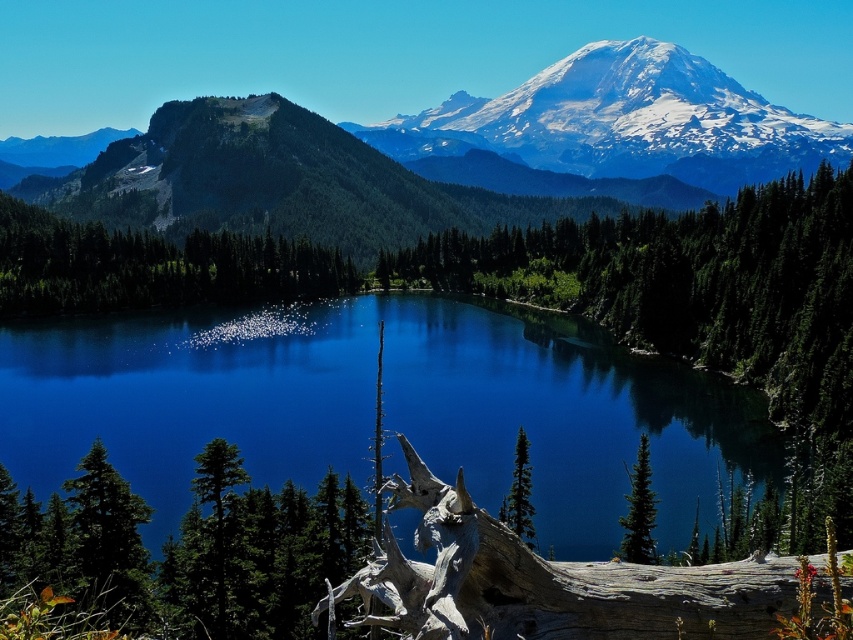
Question: Can you confirm if green matte tree at center-right is positioned to the right of green matte tree at center?

Choices:
 (A) yes
 (B) no

Answer: (A)

Question: Which object is closer to the camera taking this photo?

Choices:
 (A) green forested mountain at upper left
 (B) green matte tree at center
 (C) deep blue water at center

Answer: (B)

Question: Is gray textured log at lower center bigger than green matte tree at center-right?

Choices:
 (A) yes
 (B) no

Answer: (A)

Question: Considering the real-world distances, which object is closest to the green matte tree at center-right?

Choices:
 (A) gray textured log at lower center
 (B) deep blue water at center

Answer: (A)

Question: Based on their relative distances, which object is farther from the snowy white mountain at upper center?

Choices:
 (A) green matte tree at center
 (B) deep blue water at center
 (C) gray textured log at lower center

Answer: (C)

Question: From the image, what is the correct spatial relationship of green matte tree at left in relation to green matte tree at center?

Choices:
 (A) left
 (B) right

Answer: (A)